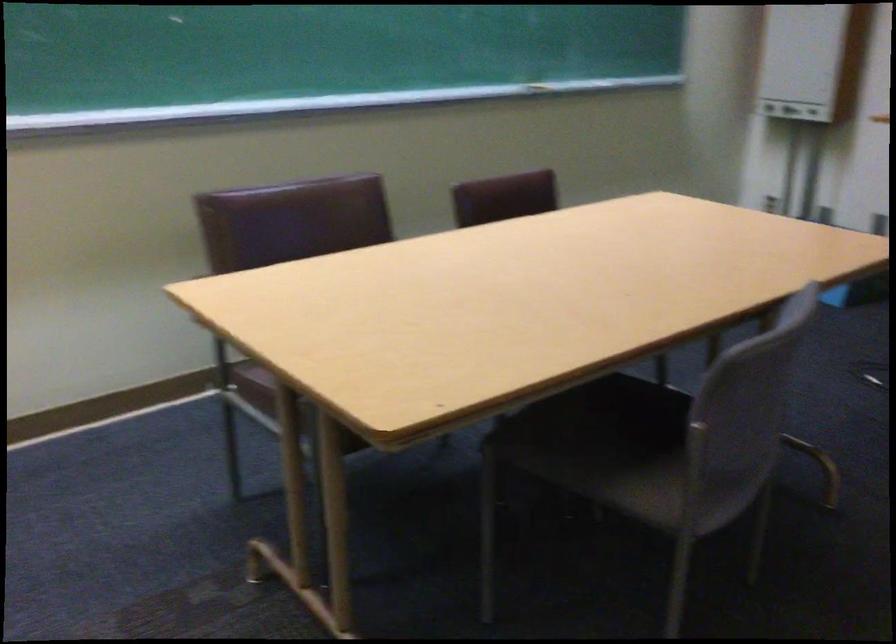
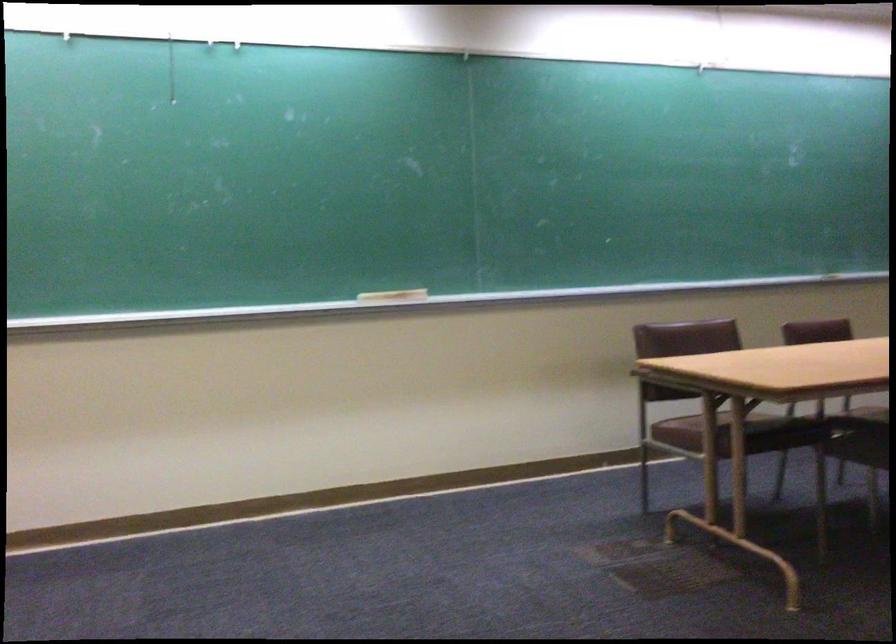
Question: Which direction would the cameraman need to move to produce the second image? Reply with the corresponding letter.

Choices:
 (A) Left
 (B) Right
 (C) Forward
 (D) Backward

Answer: (D)